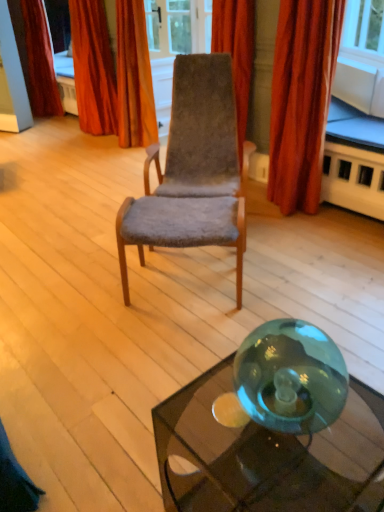
Question: Do you think velvet-like red curtain at upper left, marked as the first curtain in a left-to-right arrangement, is within velvet-like red curtain at right, the 4th curtain viewed from the left, or outside of it?

Choices:
 (A) outside
 (B) inside

Answer: (A)

Question: From the image's perspective, is velvet-like red curtain at upper left, arranged as the fourth curtain when viewed from the right, above or below velvet-like red curtain at right, the 4th curtain viewed from the left?

Choices:
 (A) above
 (B) below

Answer: (A)

Question: Estimate the real-world distances between objects in this image. Which object is farther from the velvet-like red curtain at upper left, positioned as the third curtain in right-to-left order?

Choices:
 (A) velvet brown chair at center
 (B) transparent glass table at lower right, the second table viewed from the front
 (C) transparent glass table at lower right, the first table viewed from the front
 (D) velvet-like red curtain at right, the 4th curtain viewed from the left
 (E) velvet-like red curtain at upper left, arranged as the fourth curtain when viewed from the right

Answer: (C)

Question: Considering the real-world distances, which object is farthest from the transparent glass table at lower right, the 2th table viewed from the left?

Choices:
 (A) velvet-like orange curtain at upper center, marked as the second curtain in a right-to-left arrangement
 (B) velvet-like red curtain at upper left, which appears as the 2th curtain when viewed from the left
 (C) velvet brown chair at center
 (D) velvet-like red curtain at right, which is counted as the 1th curtain, starting from the right
 (E) velvet-like red curtain at upper left, arranged as the fourth curtain when viewed from the right

Answer: (E)